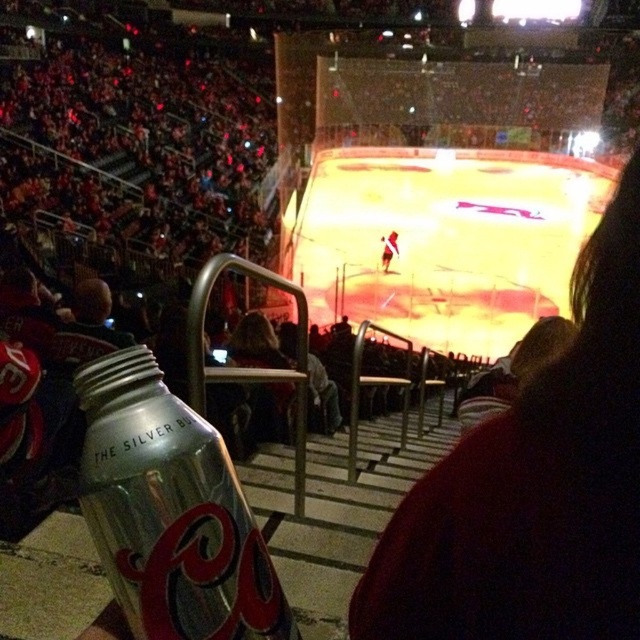
Consider the image. You are a photographer at the hockey arena. You want to take a photo of the silver metallic can at lower left without any obstructions. Since the dark hair at center is in the way, where should you move to get a clear shot?

The silver metallic can at lower left is behind the dark hair at center, so moving to the left side would allow you to see the silver metallic can at lower left without obstruction from the dark hair at center.

Based on the photo, you are standing in the hockey arena and want to know which of the two points, point (586, 598) or point (97, 508), is closer to you. Can you determine this based on their positions?

Point (586, 598) is further to the viewer than point (97, 508), so point (97, 508) is closer to you.